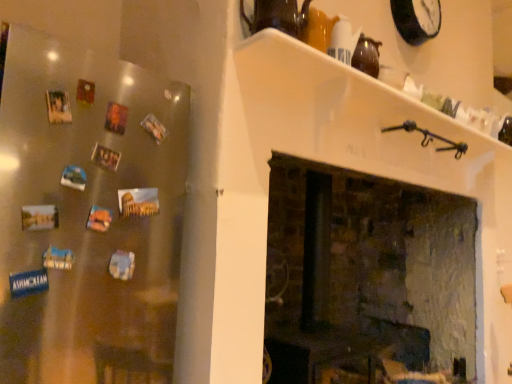
This screenshot has height=384, width=512. I want to click on vacant location below matte brown teapot at upper center (from a real-world perspective), so click(273, 50).